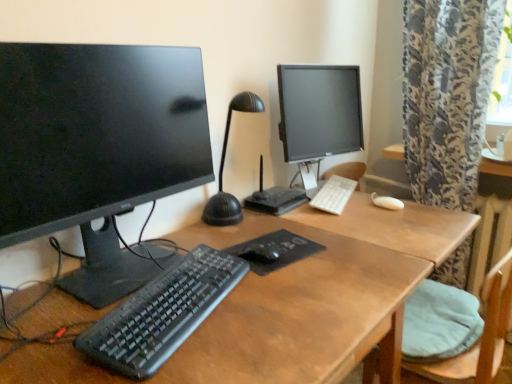
Find the location of `vacant space to the right of black plastic keyboard at center, the first computer keyboard positioned from the bottom`. vacant space to the right of black plastic keyboard at center, the first computer keyboard positioned from the bottom is located at coordinates (291, 300).